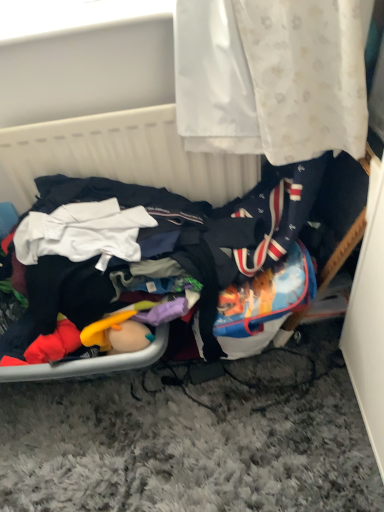
Question: Does multicolored fabric pile at lower left lie in front of white fabric basket at upper center?

Choices:
 (A) no
 (B) yes

Answer: (B)

Question: From a real-world perspective, is multicolored fabric pile at lower left positioned over white fabric basket at upper center based on gravity?

Choices:
 (A) no
 (B) yes

Answer: (A)

Question: Does multicolored fabric pile at lower left turn towards white fabric basket at upper center?

Choices:
 (A) yes
 (B) no

Answer: (A)

Question: Does multicolored fabric pile at lower left have a lesser width compared to white fabric basket at upper center?

Choices:
 (A) no
 (B) yes

Answer: (A)

Question: Considering the relative sizes of multicolored fabric pile at lower left and white fabric basket at upper center in the image provided, is multicolored fabric pile at lower left taller than white fabric basket at upper center?

Choices:
 (A) yes
 (B) no

Answer: (B)

Question: Is multicolored fabric pile at lower left shorter than white fabric basket at upper center?

Choices:
 (A) yes
 (B) no

Answer: (A)

Question: Would you say white fabric basket at upper center is outside multicolored fabric pile at lower left?

Choices:
 (A) yes
 (B) no

Answer: (A)

Question: Is white fabric basket at upper center at the left side of multicolored fabric pile at lower left?

Choices:
 (A) yes
 (B) no

Answer: (A)

Question: From the image's perspective, is white fabric basket at upper center under multicolored fabric pile at lower left?

Choices:
 (A) yes
 (B) no

Answer: (B)

Question: From a real-world perspective, is white fabric basket at upper center located beneath multicolored fabric pile at lower left?

Choices:
 (A) yes
 (B) no

Answer: (B)

Question: Does white fabric basket at upper center come in front of multicolored fabric pile at lower left?

Choices:
 (A) yes
 (B) no

Answer: (B)

Question: Does white fabric basket at upper center have a lesser width compared to multicolored fabric pile at lower left?

Choices:
 (A) no
 (B) yes

Answer: (B)

Question: Is multicolored fabric pile at lower left bigger or smaller than white fabric basket at upper center?

Choices:
 (A) big
 (B) small

Answer: (A)